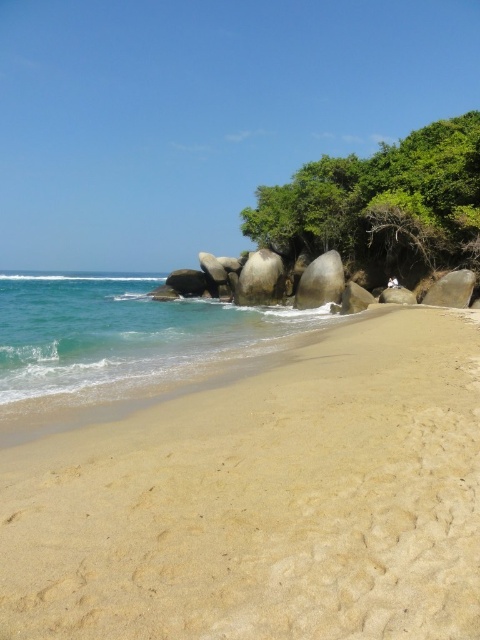
You are a beachcomber searching for hidden treasures. You have a small metal detector that can scan an area of 1 square meter. You notice the light beige sand at center and the smooth granite boulder at center. Which object should you prioritize scanning with your metal detector?

The light beige sand at center is larger in size than the smooth granite boulder at center, so you should prioritize scanning the light beige sand at center because it covers a bigger area and has a higher chance of containing hidden treasures.